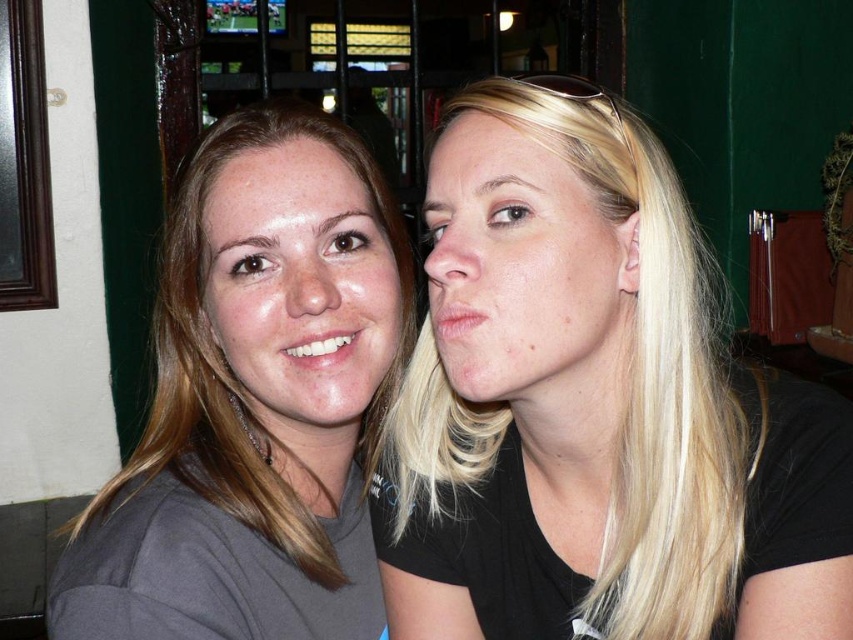
Question: Which point appears farthest from the camera in this image?

Choices:
 (A) (494, 154)
 (B) (654, 561)

Answer: (B)

Question: Does smooth skin face at right lie in front of matte gray face at center?

Choices:
 (A) yes
 (B) no

Answer: (A)

Question: Which point is closer to the camera?

Choices:
 (A) (358, 300)
 (B) (274, 540)

Answer: (A)

Question: Which of the following is the closest to the observer?

Choices:
 (A) (241, 344)
 (B) (550, 298)

Answer: (B)

Question: Does blonde hair at center have a larger size compared to matte gray face at center?

Choices:
 (A) yes
 (B) no

Answer: (A)

Question: Is blonde hair at center further to camera compared to smooth skin face at right?

Choices:
 (A) yes
 (B) no

Answer: (A)